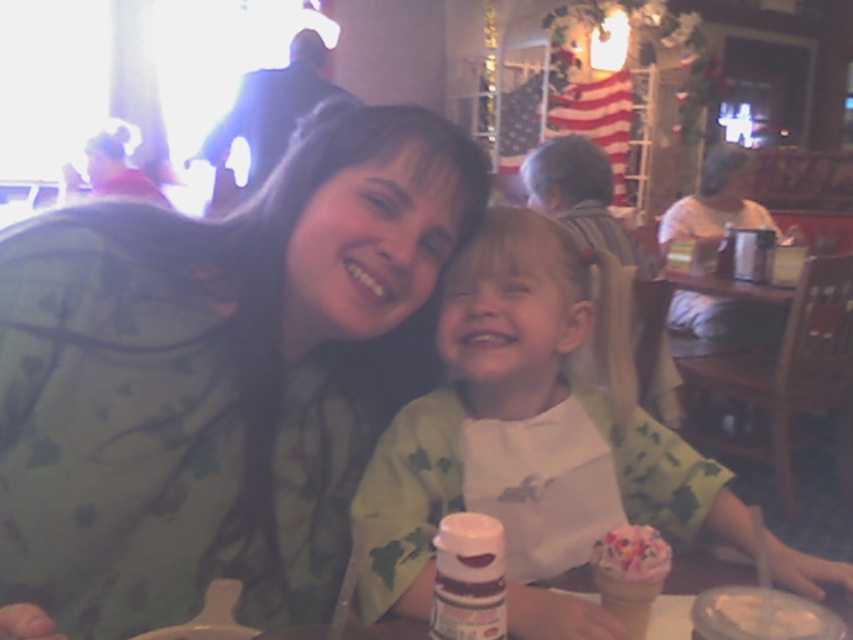
Question: Does matte green shirt at center have a lesser width compared to pink frosted ice cream at center?

Choices:
 (A) yes
 (B) no

Answer: (B)

Question: Considering the real-world distances, which object is closest to the matte green shirt at center?

Choices:
 (A) pink frosted ice cream at center
 (B) white paper cupcake at center

Answer: (B)

Question: Does white paper cupcake at center have a larger size compared to pink frosted ice cream at center?

Choices:
 (A) yes
 (B) no

Answer: (A)

Question: Which is farther from the white paper cupcake at center?

Choices:
 (A) matte green shirt at center
 (B) pink frosted ice cream at center

Answer: (B)

Question: Can you confirm if matte green shirt at center is positioned to the right of smooth white ice cream cone at lower center?

Choices:
 (A) no
 (B) yes

Answer: (A)

Question: Which point is closer to the camera?

Choices:
 (A) smooth white ice cream cone at lower center
 (B) white paper cupcake at center
 (C) pink frosted ice cream at center

Answer: (A)